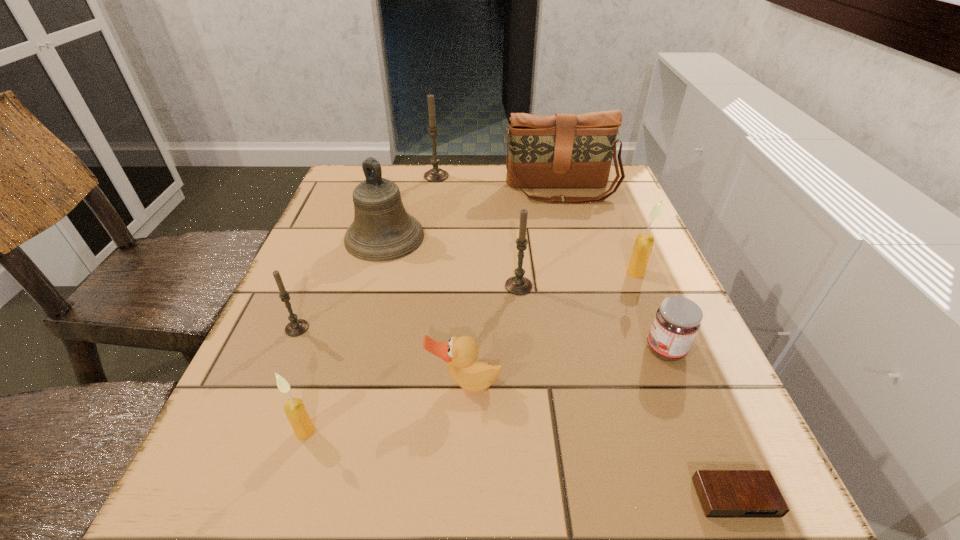
Identify the location of vacant space positioned 0.160m on the front of the bigger cream candle. (662, 338).

Where is `free spot located 0.160m on the front of the fourth candle from left to right`? Image resolution: width=960 pixels, height=540 pixels. free spot located 0.160m on the front of the fourth candle from left to right is located at coordinates (526, 361).

Identify the location of vacant space located 0.320m on the front of the leftmost gray candle. This screenshot has height=540, width=960. (209, 536).

The height and width of the screenshot is (540, 960). What are the coordinates of `free space located on the back of the smaller cream candle` in the screenshot? It's located at (362, 255).

At what (x,y) coordinates should I click in order to perform the action: click on vacant area situated 0.170m on the beak of the tan duck. Please return your answer as a coordinate pair (x, y). Looking at the image, I should click on point(461,514).

The image size is (960, 540). Identify the location of free space located on the front of the red jam. (702, 439).

The height and width of the screenshot is (540, 960). Identify the location of candle that is at the far edge. (435, 174).

You are a GUI agent. You are given a task and a screenshot of the screen. Output one action in this format:
    pyautogui.click(x=<x>, y=<y>)
    Task: Click on the shoulder bag situated at the far edge
    The height and width of the screenshot is (540, 960).
    Given the screenshot: What is the action you would take?
    pyautogui.click(x=564, y=150)

The height and width of the screenshot is (540, 960). In order to click on object that is at the near edge in this screenshot , I will do `click(722, 493)`.

This screenshot has height=540, width=960. I want to click on bell that is at the left edge, so click(382, 230).